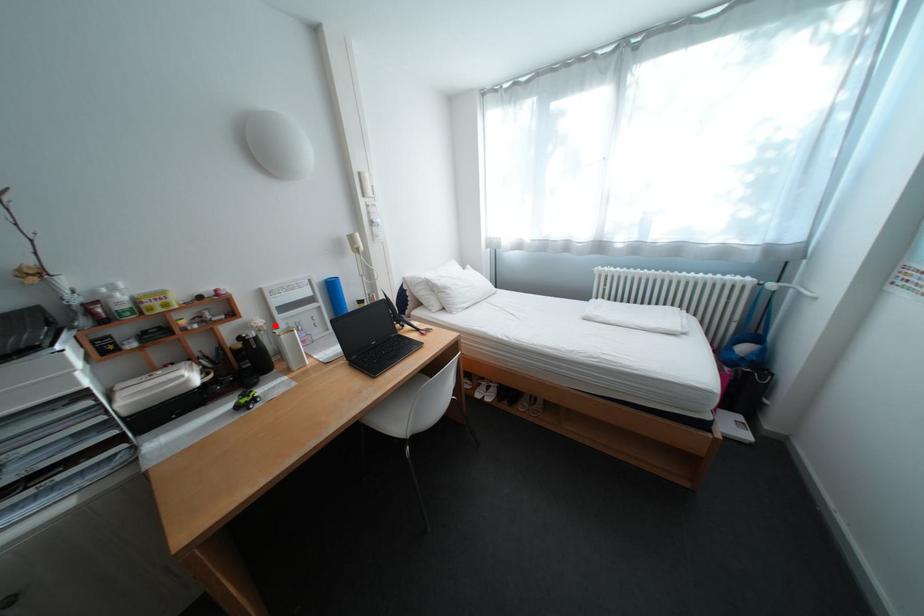
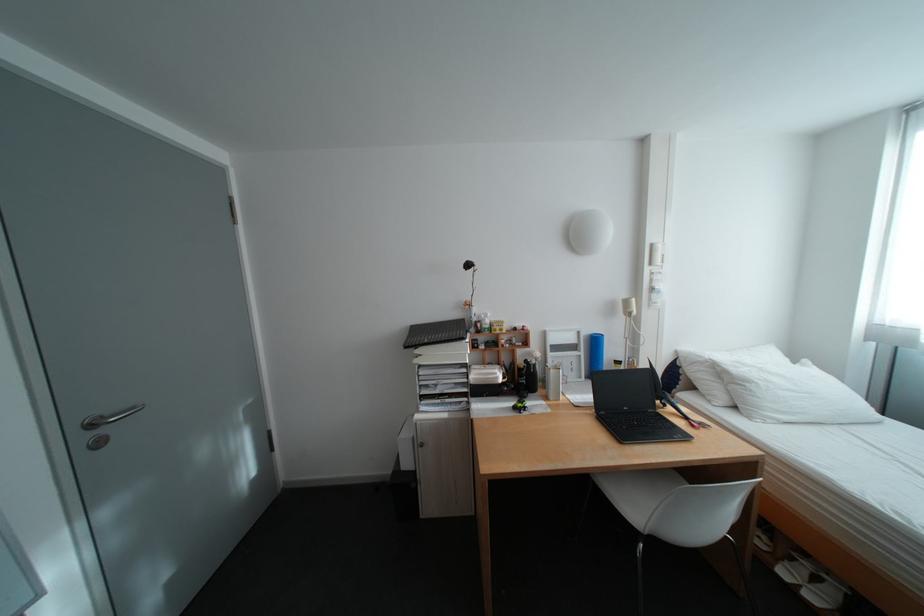
Question: I am providing you with two images of the same scene from different viewpoints. In image1, a red point is highlighted. Considering the same 3D point in image2, which of the following is correct?

Choices:
 (A) It is closer
 (B) It is farther

Answer: (B)